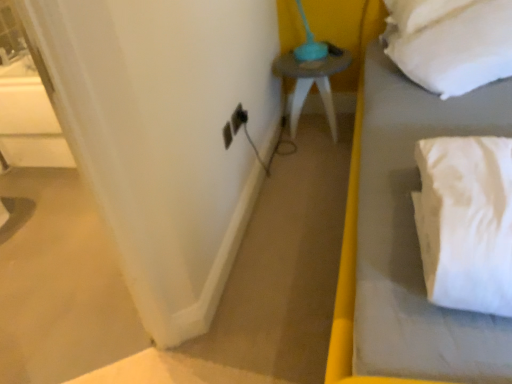
Question: Should I look upward or downward to see matte gray side table at center?

Choices:
 (A) down
 (B) up

Answer: (B)

Question: Is white fabric curtain at left facing away from matte gray side table at center?

Choices:
 (A) no
 (B) yes

Answer: (A)

Question: Can you confirm if white fabric curtain at left is positioned to the right of matte gray side table at center?

Choices:
 (A) yes
 (B) no

Answer: (B)

Question: Does white fabric curtain at left have a smaller size compared to matte gray side table at center?

Choices:
 (A) yes
 (B) no

Answer: (A)

Question: From a real-world perspective, is white fabric curtain at left beneath matte gray side table at center?

Choices:
 (A) no
 (B) yes

Answer: (A)

Question: Is white fabric curtain at left outside matte gray side table at center?

Choices:
 (A) yes
 (B) no

Answer: (A)

Question: Can you confirm if white fabric curtain at left is bigger than matte gray side table at center?

Choices:
 (A) yes
 (B) no

Answer: (B)

Question: From the image's perspective, is white soft bed at right on white fabric curtain at left?

Choices:
 (A) yes
 (B) no

Answer: (A)

Question: From the image's perspective, is white soft bed at right located beneath white fabric curtain at left?

Choices:
 (A) no
 (B) yes

Answer: (A)

Question: From a real-world perspective, is white soft bed at right physically below white fabric curtain at left?

Choices:
 (A) no
 (B) yes

Answer: (B)

Question: Does white soft bed at right have a lesser height compared to white fabric curtain at left?

Choices:
 (A) no
 (B) yes

Answer: (B)

Question: Is white soft bed at right in contact with white fabric curtain at left?

Choices:
 (A) yes
 (B) no

Answer: (B)

Question: Is white soft bed at right not close to white fabric curtain at left?

Choices:
 (A) no
 (B) yes

Answer: (A)

Question: Would you say white fabric curtain at left is part of matte gray side table at center's contents?

Choices:
 (A) no
 (B) yes

Answer: (A)